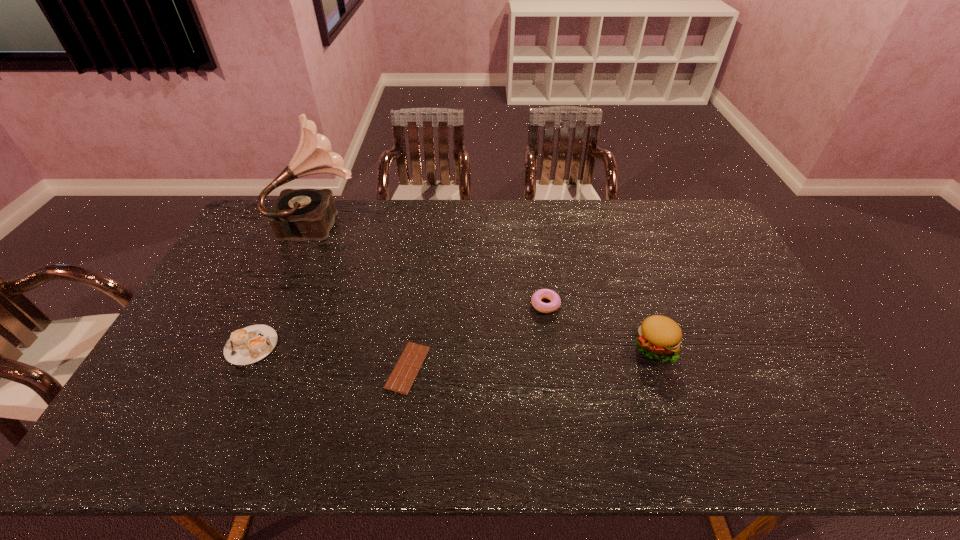
Identify the location of free space between the chocolate bar and the cappuccino. The width and height of the screenshot is (960, 540). (329, 356).

You are a GUI agent. You are given a task and a screenshot of the screen. Output one action in this format:
    pyautogui.click(x=<x>, y=<y>)
    Task: Click on the free spot between the record player and the shortest object
    This screenshot has height=540, width=960.
    Given the screenshot: What is the action you would take?
    pyautogui.click(x=365, y=295)

The height and width of the screenshot is (540, 960). What are the coordinates of `free space between the cappuccino and the doughnut` in the screenshot? It's located at (398, 325).

Where is `free point between the cappuccino and the fourth shortest object`? Image resolution: width=960 pixels, height=540 pixels. free point between the cappuccino and the fourth shortest object is located at coordinates (453, 346).

Locate an element on the screen. Image resolution: width=960 pixels, height=540 pixels. object that stands as the fourth closest to the third object from right to left is located at coordinates (659, 337).

Where is `object that is the second nearest to the rightmost object`? Image resolution: width=960 pixels, height=540 pixels. object that is the second nearest to the rightmost object is located at coordinates (405, 371).

The height and width of the screenshot is (540, 960). What are the coordinates of `free spot that satisfies the following two spatial constraints: 1. on the back side of the hamburger; 2. from the horn of the tallest object` in the screenshot? It's located at (612, 222).

Where is `free space that satisfies the following two spatial constraints: 1. on the front side of the second object from right to left; 2. on the left side of the rightmost object`? free space that satisfies the following two spatial constraints: 1. on the front side of the second object from right to left; 2. on the left side of the rightmost object is located at coordinates (551, 346).

Locate an element on the screen. vacant region that satisfies the following two spatial constraints: 1. from the horn of the tallest object; 2. on the front side of the cappuccino is located at coordinates (271, 345).

Locate an element on the screen. This screenshot has height=540, width=960. free region that satisfies the following two spatial constraints: 1. from the horn of the tallest object; 2. on the right side of the chocolate bar is located at coordinates (261, 367).